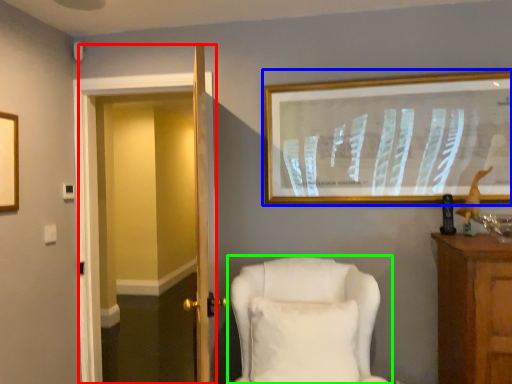
Question: Considering the real-world distances, which object is farthest from glass door (highlighted by a red box)? picture frame (highlighted by a blue box) or chair (highlighted by a green box)?

Choices:
 (A) picture frame
 (B) chair

Answer: (B)